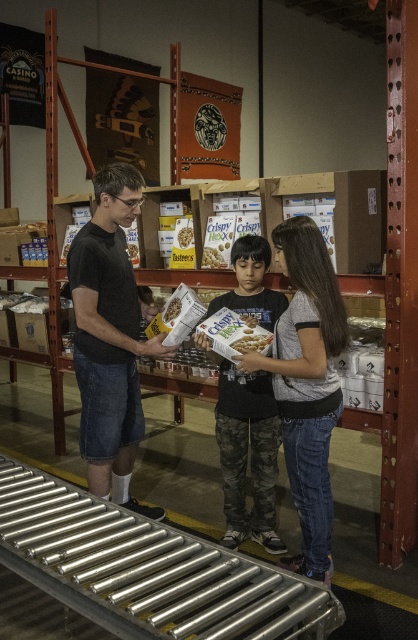
You are standing in the warehouse and see two points marked in the image. Which point, point (293, 474) or point (216, 250), is closer to you?

Point (293, 474) is closer to the viewer than point (216, 250).

You are standing in the warehouse and see the matte black shirt at center and the white cardboard box at center. Which object is nearer to you?

The matte black shirt at center is closer to the viewer than the white cardboard box at center.

You are standing at the entrance of the warehouse and see the matte black shirt at center and the camouflage pants at center. Which one is positioned to the left?

The matte black shirt at center is positioned to the left of the camouflage pants at center.